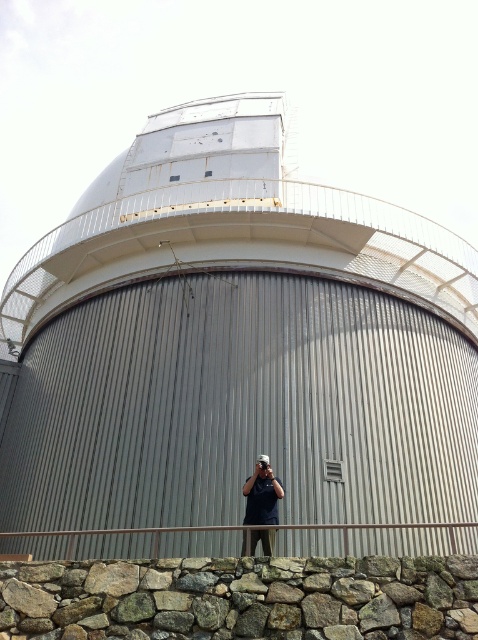
Question: In this image, where is rusty metal observatory at center located relative to dark blue shirt at center?

Choices:
 (A) above
 (B) below

Answer: (A)

Question: Is rusty metal observatory at center to the right of dark blue shirt at center from the viewer's perspective?

Choices:
 (A) yes
 (B) no

Answer: (B)

Question: Which object is farther from the camera taking this photo?

Choices:
 (A) rusty metal observatory at center
 (B) dark blue shirt at center

Answer: (B)

Question: Which point is closer to the camera?

Choices:
 (A) (271, 554)
 (B) (252, 324)

Answer: (A)

Question: Can you confirm if rusty metal observatory at center is positioned below dark blue shirt at center?

Choices:
 (A) no
 (B) yes

Answer: (A)